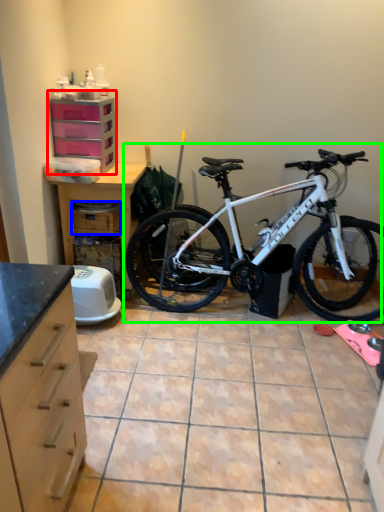
Question: Estimate the real-world distances between objects in this image. Which object is closer to file cabinet (highlighted by a red box), crate (highlighted by a blue box) or bicycle (highlighted by a green box)?

Choices:
 (A) crate
 (B) bicycle

Answer: (A)